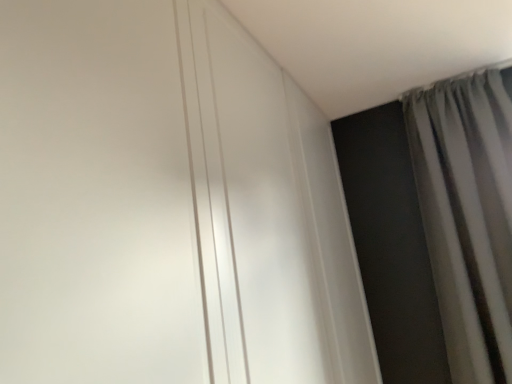
The height and width of the screenshot is (384, 512). I want to click on gray fabric curtain at upper right, so click(468, 216).

Measure the distance between point (509,118) and camera.

Point (509,118) is 6.84 feet from camera.

Measure the distance between gray fabric curtain at upper right and camera.

gray fabric curtain at upper right is 5.73 feet away from camera.

The width and height of the screenshot is (512, 384). What do you see at coordinates (468, 216) in the screenshot? I see `gray fabric curtain at upper right` at bounding box center [468, 216].

At what (x,y) coordinates should I click in order to perform the action: click on white glossy door at upper center. Please return your answer as a coordinate pair (x, y). The height and width of the screenshot is (384, 512). Looking at the image, I should click on [x=96, y=197].

Measure the distance between white glossy door at upper center and camera.

The distance of white glossy door at upper center from camera is 20.91 inches.

The width and height of the screenshot is (512, 384). What do you see at coordinates (96, 197) in the screenshot?
I see `white glossy door at upper center` at bounding box center [96, 197].

Where is `gray fabric curtain at upper right`? gray fabric curtain at upper right is located at coordinates (468, 216).

Based on their positions, is gray fabric curtain at upper right located to the left or right of white glossy door at upper center?

Based on their positions, gray fabric curtain at upper right is located to the right of white glossy door at upper center.

Relative to white glossy door at upper center, is gray fabric curtain at upper right in front or behind?

gray fabric curtain at upper right is positioned farther from the viewer than white glossy door at upper center.

Which point is more forward, (x=486, y=88) or (x=88, y=63)?

The point (x=88, y=63) is closer.

From the picture: From the image's perspective, who appears lower, gray fabric curtain at upper right or white glossy door at upper center?

gray fabric curtain at upper right appears lower in the image.

From a real-world perspective, is gray fabric curtain at upper right located higher than white glossy door at upper center?

Actually, gray fabric curtain at upper right is physically below white glossy door at upper center in the real world.

Is gray fabric curtain at upper right wider than white glossy door at upper center?

Yes, gray fabric curtain at upper right is wider than white glossy door at upper center.

Between gray fabric curtain at upper right and white glossy door at upper center, which one has less height?

With less height is white glossy door at upper center.

Considering the relative sizes of gray fabric curtain at upper right and white glossy door at upper center in the image provided, is gray fabric curtain at upper right bigger than white glossy door at upper center?

Indeed, gray fabric curtain at upper right has a larger size compared to white glossy door at upper center.

Can white glossy door at upper center be found inside gray fabric curtain at upper right?

No, white glossy door at upper center is not surrounded by gray fabric curtain at upper right.

Is gray fabric curtain at upper right far from white glossy door at upper center?

gray fabric curtain at upper right is positioned a significant distance from white glossy door at upper center.

Could you tell me if gray fabric curtain at upper right is facing white glossy door at upper center?

No, gray fabric curtain at upper right is not facing towards white glossy door at upper center.

What's the angular difference between gray fabric curtain at upper right and white glossy door at upper center's facing directions?

90.3 degrees.

This screenshot has width=512, height=384. What are the coordinates of `door above the gray fabric curtain at upper right (from the image's perspective)` in the screenshot? It's located at (96, 197).

Does white glossy door at upper center appear on the left side of gray fabric curtain at upper right?

Correct, you'll find white glossy door at upper center to the left of gray fabric curtain at upper right.

In the image, is white glossy door at upper center positioned in front of or behind gray fabric curtain at upper right?

Visually, white glossy door at upper center is located in front of gray fabric curtain at upper right.

Is point (51, 304) closer to camera compared to point (492, 87)?

Yes, it is.

From the image's perspective, is white glossy door at upper center positioned above or below gray fabric curtain at upper right?

Clearly, from the image's perspective, white glossy door at upper center is above gray fabric curtain at upper right.

From a real-world perspective, is white glossy door at upper center below gray fabric curtain at upper right?

No.

Is white glossy door at upper center thinner than gray fabric curtain at upper right?

Indeed, white glossy door at upper center has a lesser width compared to gray fabric curtain at upper right.

Is white glossy door at upper center taller or shorter than gray fabric curtain at upper right?

In the image, white glossy door at upper center appears to be shorter than gray fabric curtain at upper right.

Consider the image. Is white glossy door at upper center bigger than gray fabric curtain at upper right?

No, white glossy door at upper center is not bigger than gray fabric curtain at upper right.

Do you think white glossy door at upper center is within gray fabric curtain at upper right, or outside of it?

white glossy door at upper center is spatially situated outside gray fabric curtain at upper right.

Consider the image. Are white glossy door at upper center and gray fabric curtain at upper right making contact?

No, white glossy door at upper center is not next to gray fabric curtain at upper right.

Is white glossy door at upper center facing away from gray fabric curtain at upper right?

No, white glossy door at upper center is not facing the opposite direction of gray fabric curtain at upper right.

How many degrees apart are the facing directions of white glossy door at upper center and gray fabric curtain at upper right?

They differ by 90.3 degrees in their facing directions.

Locate an element on the screen. The height and width of the screenshot is (384, 512). door to the left of gray fabric curtain at upper right is located at coordinates (96, 197).

The height and width of the screenshot is (384, 512). Identify the location of curtain below the white glossy door at upper center (from the image's perspective). pyautogui.click(x=468, y=216).

The height and width of the screenshot is (384, 512). What are the coordinates of `curtain on the right of white glossy door at upper center` in the screenshot? It's located at (468, 216).